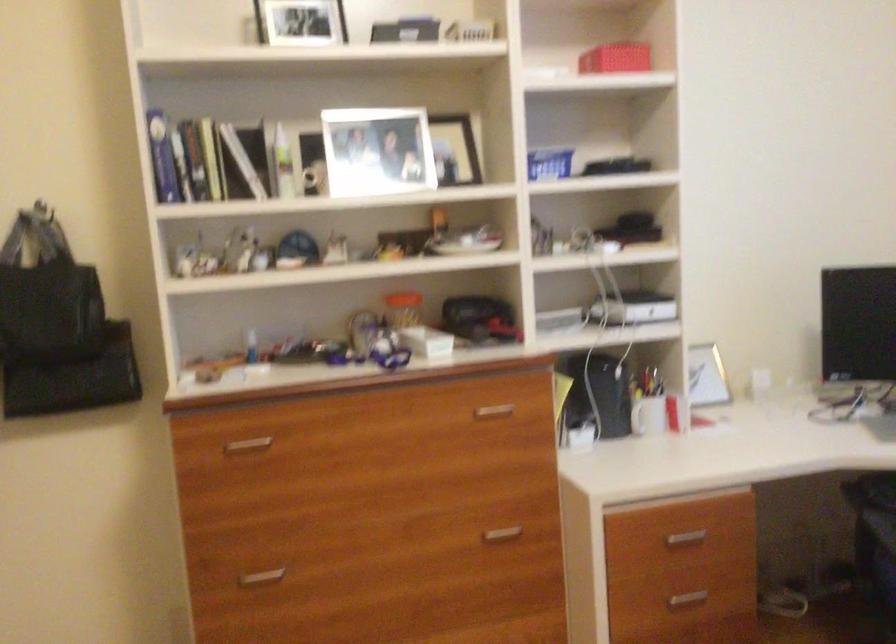
Image resolution: width=896 pixels, height=644 pixels. I want to click on hardcover book, so click(207, 160).